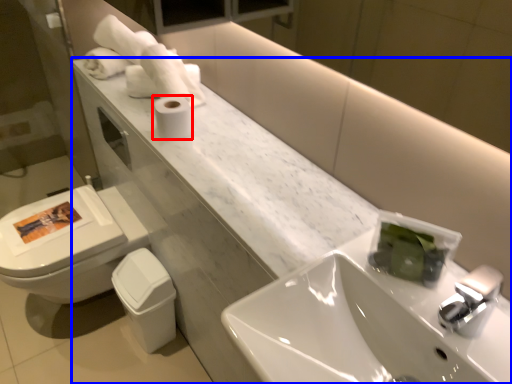
Question: Which object appears farthest to the camera in this image, toilet paper (highlighted by a red box) or counter (highlighted by a blue box)?

Choices:
 (A) toilet paper
 (B) counter

Answer: (A)